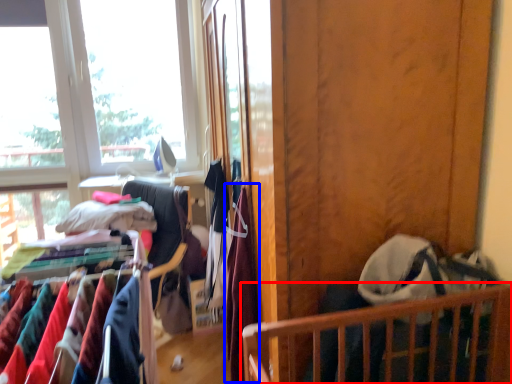
Question: Which point is further to the camera, furniture (highlighted by a red box) or clothing (highlighted by a blue box)?

Choices:
 (A) furniture
 (B) clothing

Answer: (B)